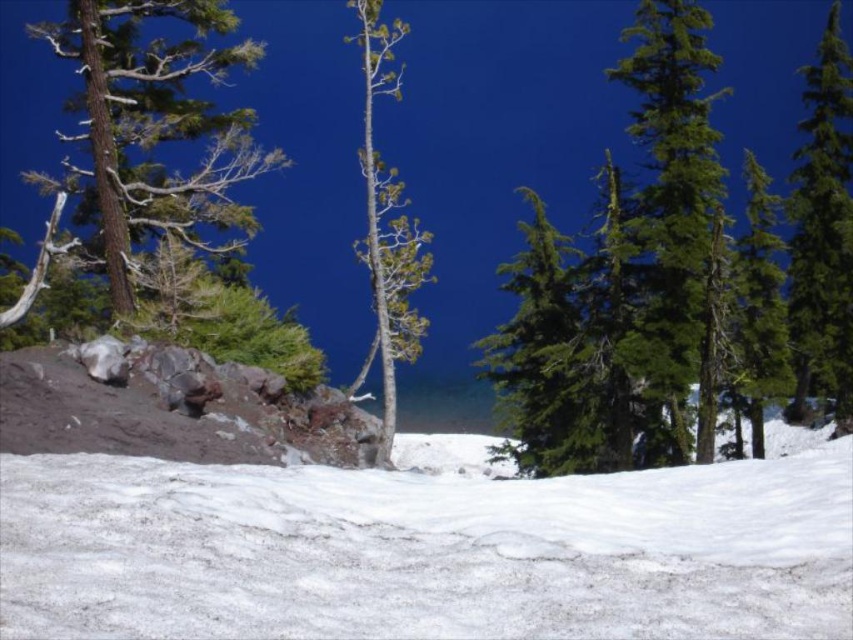
You are an outdoor photographer aiming to capture a shot of both the green matte tree at upper right and the green glossy tree at right. From your current position, which tree is positioned to the left when looking towards the right side of the scene?

The green matte tree at upper right is to the left of the green glossy tree at right, so when looking towards the right side of the scene, the green matte tree at upper right is positioned to the left.

You are an outdoor photographer planning to capture the white snow at center and the brown rough bark tree at left in a single frame. Based on their heights, which object would appear larger in the photo?

The brown rough bark tree at left would appear larger in the photo since it is taller than the white snow at center.